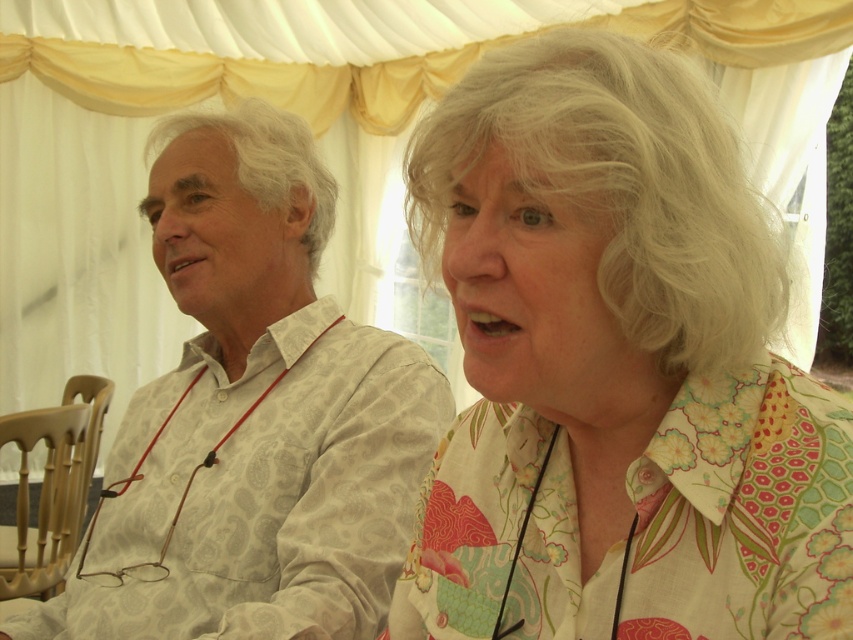
Question: Does floral cotton blouse at upper right appear on the right side of white paisley shirt at left?

Choices:
 (A) no
 (B) yes

Answer: (B)

Question: Is floral cotton blouse at upper right bigger than white paisley shirt at left?

Choices:
 (A) no
 (B) yes

Answer: (A)

Question: Which point is farther from the camera taking this photo?

Choices:
 (A) (486, 330)
 (B) (277, 170)

Answer: (B)

Question: Does floral cotton blouse at upper right appear on the right side of white paisley shirt at left?

Choices:
 (A) no
 (B) yes

Answer: (B)

Question: Among these points, which one is nearest to the camera?

Choices:
 (A) (309, 138)
 (B) (631, 40)

Answer: (B)